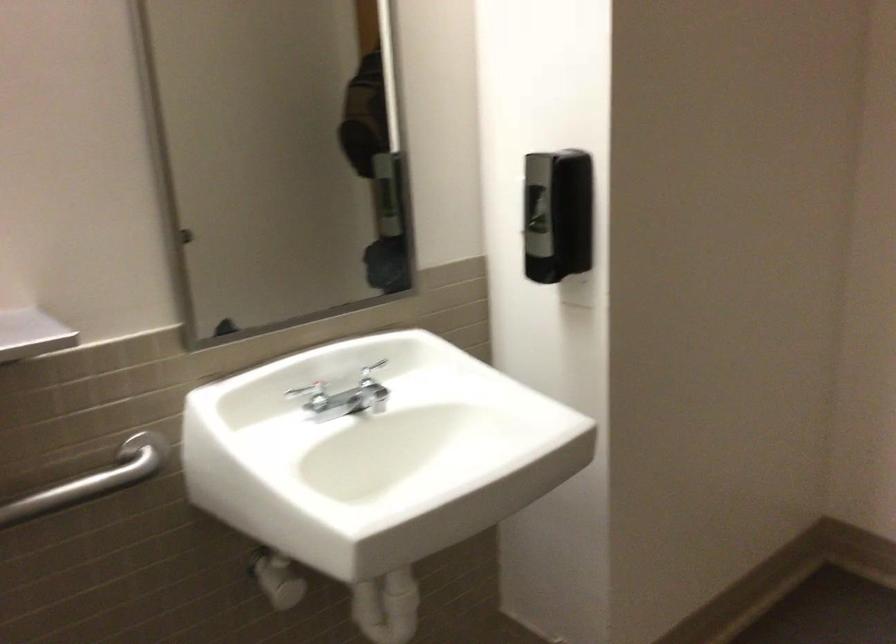
Where is `soap dispenser button`? The width and height of the screenshot is (896, 644). soap dispenser button is located at coordinates (536, 207).